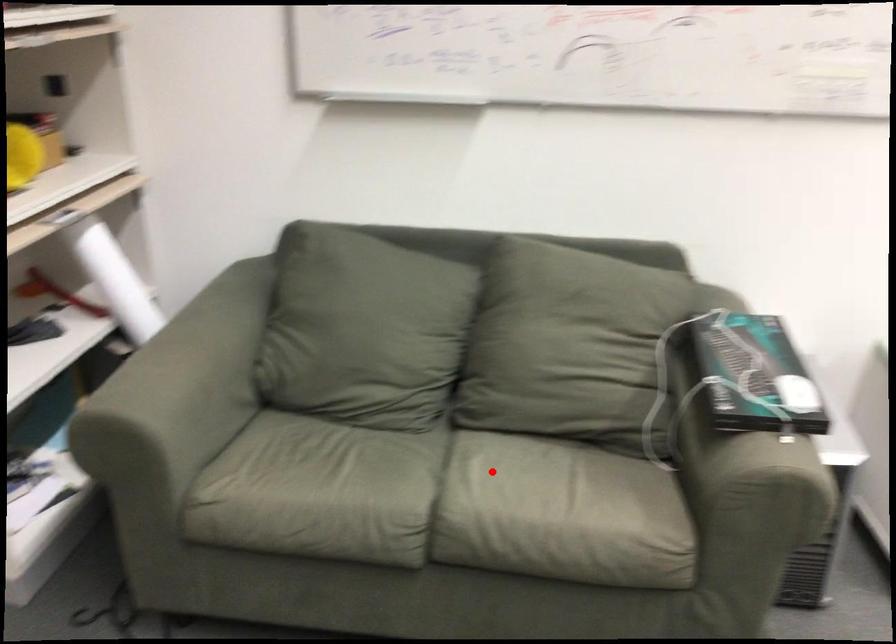
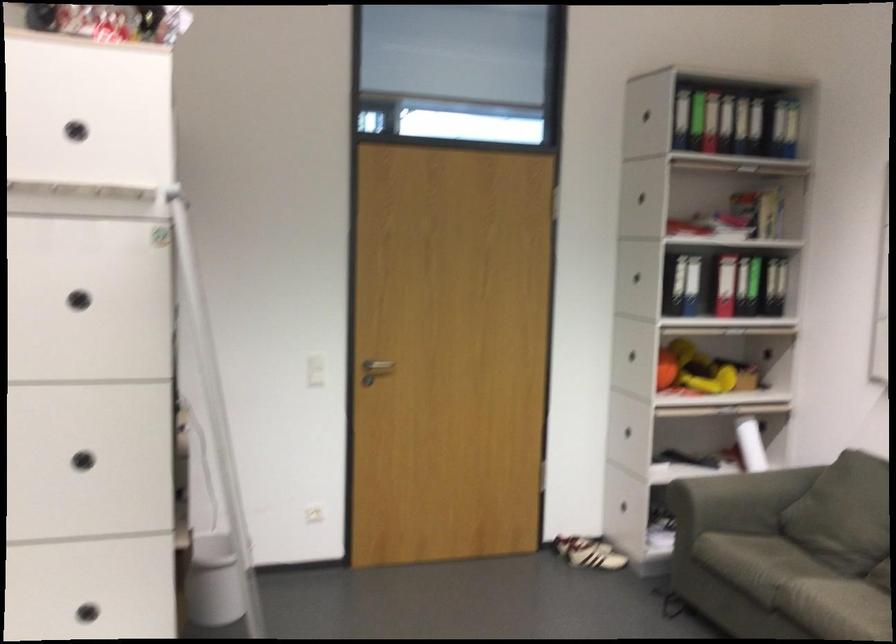
Question: I am providing you with two images of the same scene from different viewpoints. Given a red point in image1, look at the same physical point in image2. Is it:

Choices:
 (A) Closer to the viewpoint
 (B) Farther from the viewpoint

Answer: (B)